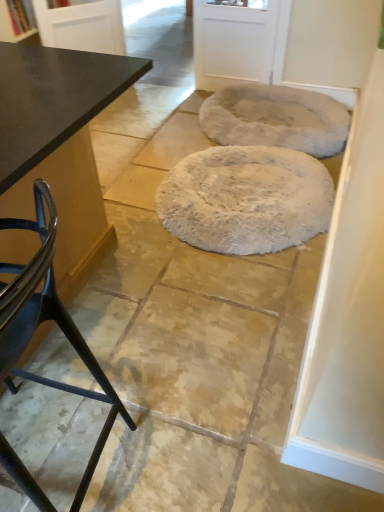
Question: Which direction should I rotate to face white fluffy rug at center, the 1th mat when ordered from front to back, — up or down?

Choices:
 (A) up
 (B) down

Answer: (A)

Question: Is the surface of white fluffy rug at center, the 1th mat when ordered from front to back, in direct contact with black matte table at left?

Choices:
 (A) yes
 (B) no

Answer: (B)

Question: From the image's perspective, would you say white fluffy rug at center, the 1th mat when ordered from front to back, is shown under black matte table at left?

Choices:
 (A) no
 (B) yes

Answer: (A)

Question: Is white fluffy rug at center, the 1th mat when ordered from front to back, shorter than black matte table at left?

Choices:
 (A) no
 (B) yes

Answer: (B)

Question: Could you tell me if white fluffy rug at center, acting as the second mat starting from the back, is facing black matte table at left?

Choices:
 (A) no
 (B) yes

Answer: (A)

Question: Is white fluffy rug at center, the 1th mat when ordered from front to back, surrounding black matte table at left?

Choices:
 (A) no
 (B) yes

Answer: (A)

Question: Considering the relative positions of white fluffy rug at center, the 1th mat when ordered from front to back, and black matte table at left in the image provided, is white fluffy rug at center, the 1th mat when ordered from front to back, to the right of black matte table at left from the viewer's perspective?

Choices:
 (A) no
 (B) yes

Answer: (B)

Question: Is white matte screen door at upper center, arranged as the first screen door when viewed from the right, at the back of glossy black table at upper left, arranged as the first screen door when viewed from the left?

Choices:
 (A) yes
 (B) no

Answer: (B)

Question: From a real-world perspective, is glossy black table at upper left, the 2th screen door from the right, on top of white matte screen door at upper center, placed as the 2th screen door when sorted from left to right?

Choices:
 (A) no
 (B) yes

Answer: (B)

Question: Is glossy black table at upper left, the 2th screen door from the right, facing towards white matte screen door at upper center, placed as the 2th screen door when sorted from left to right?

Choices:
 (A) yes
 (B) no

Answer: (B)

Question: Can you confirm if glossy black table at upper left, the 2th screen door from the right, is positioned to the left of white matte screen door at upper center, arranged as the first screen door when viewed from the right?

Choices:
 (A) no
 (B) yes

Answer: (B)

Question: From a real-world perspective, is glossy black table at upper left, arranged as the first screen door when viewed from the left, below white matte screen door at upper center, arranged as the first screen door when viewed from the right?

Choices:
 (A) yes
 (B) no

Answer: (B)

Question: Are glossy black table at upper left, the 2th screen door from the right, and white matte screen door at upper center, placed as the 2th screen door when sorted from left to right, far apart?

Choices:
 (A) no
 (B) yes

Answer: (A)

Question: Considering the relative sizes of glossy black table at upper left, arranged as the first screen door when viewed from the left, and fuzzy gray mat at upper right, arranged as the 2th mat when viewed from the front, in the image provided, is glossy black table at upper left, arranged as the first screen door when viewed from the left, bigger than fuzzy gray mat at upper right, arranged as the 2th mat when viewed from the front,?

Choices:
 (A) yes
 (B) no

Answer: (B)